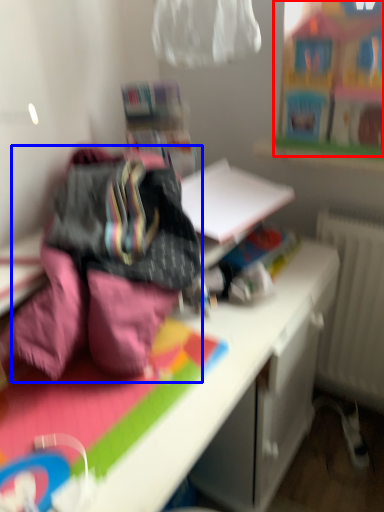
Question: Which point is further to the camera, toy (highlighted by a red box) or bedding (highlighted by a blue box)?

Choices:
 (A) toy
 (B) bedding

Answer: (A)